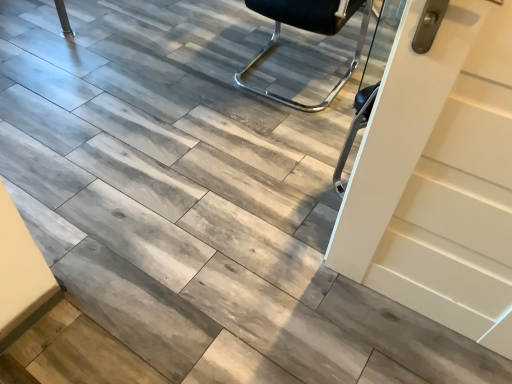
Identify the location of free point below white glossy door at right (from a real-world perspective). (409, 315).